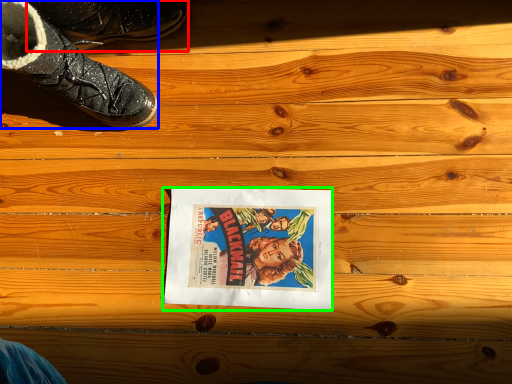
Question: Which object is the closest to the footwear (highlighted by a red box)? Choose among these: footwear (highlighted by a blue box) or movie poster (highlighted by a green box).

Choices:
 (A) footwear
 (B) movie poster

Answer: (A)